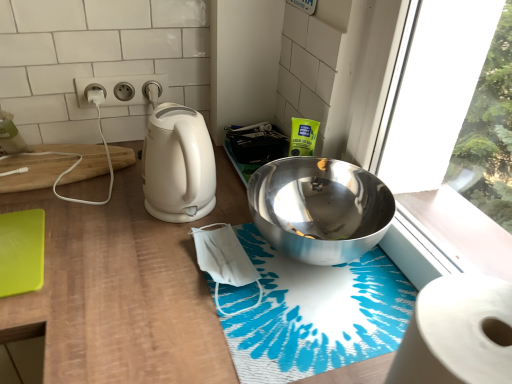
Question: Is silver metallic bowl at upper right wider or thinner than white plastic electrical outlet at upper center?

Choices:
 (A) thin
 (B) wide

Answer: (B)

Question: From a real-world perspective, relative to white plastic electrical outlet at upper center, is silver metallic bowl at upper right vertically above or below?

Choices:
 (A) below
 (B) above

Answer: (A)

Question: Estimate the real-world distances between objects in this image. Which object is farther from the silver metallic bowl at upper right?

Choices:
 (A) white plastic electrical outlet at upper center
 (B) wooden at left
 (C) blue printed bath mat at center
 (D) white glossy electric kettle at left
 (E) white paper at lower right

Answer: (A)

Question: Based on their relative distances, which object is farther from the white matte toilet paper at left?

Choices:
 (A) silver metallic bowl at upper right
 (B) green matte cutting board at lower left, the second cutting board from the top
 (C) white plastic electrical outlet at upper center
 (D) wooden cutting board at left, placed as the 1th cutting board when sorted from top to bottom
 (E) blue printed bath mat at center

Answer: (E)